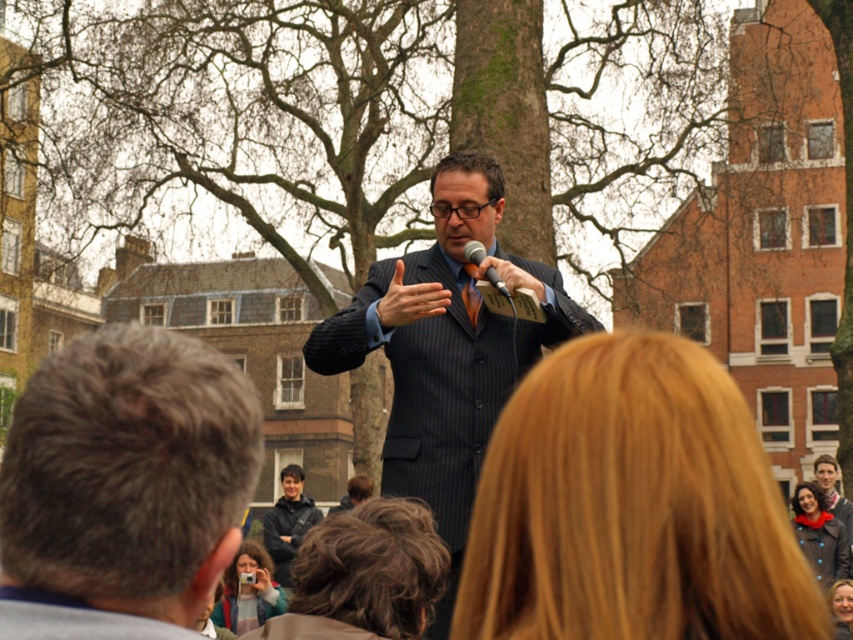
Can you confirm if dark brown hair at center is positioned below matte pink jacket at lower center?

Actually, dark brown hair at center is above matte pink jacket at lower center.

Which is more to the left, dark brown hair at center or matte pink jacket at lower center?

matte pink jacket at lower center

Identify the location of dark brown hair at center. (364, 573).

Between dark pinstripe suit at center and dark blue jacket at center, which one has less height?

dark blue jacket at center is shorter.

Is point (434, 273) farther from camera compared to point (296, 486)?

No, it is in front of (296, 486).

The height and width of the screenshot is (640, 853). What do you see at coordinates (445, 349) in the screenshot? I see `dark pinstripe suit at center` at bounding box center [445, 349].

In order to click on dark pinstripe suit at center in this screenshot , I will do `click(445, 349)`.

Is point (77, 536) positioned in front of point (505, 296)?

Yes, point (77, 536) is closer to viewer.

Image resolution: width=853 pixels, height=640 pixels. What do you see at coordinates (123, 484) in the screenshot?
I see `gray hair at center` at bounding box center [123, 484].

Is point (207, 483) in front of point (473, 246)?

Yes.

What are the coordinates of `gray hair at center` in the screenshot? It's located at (123, 484).